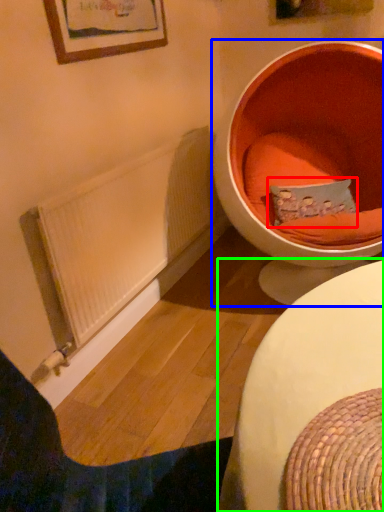
Question: Based on their relative distances, which object is nearer to pillow (highlighted by a red box)? Choose from toilet (highlighted by a blue box) and table (highlighted by a green box).

Choices:
 (A) toilet
 (B) table

Answer: (A)